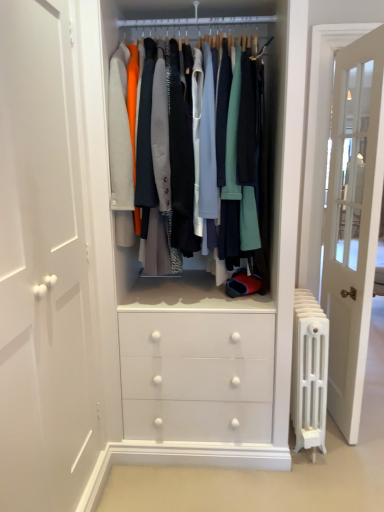
Question: Considering the relative sizes of matte white clothes at center and white metal radiator at right in the image provided, is matte white clothes at center bigger than white metal radiator at right?

Choices:
 (A) yes
 (B) no

Answer: (A)

Question: From the image's perspective, does matte white clothes at center appear higher than white metal radiator at right?

Choices:
 (A) yes
 (B) no

Answer: (A)

Question: From a real-world perspective, is matte white clothes at center under white metal radiator at right?

Choices:
 (A) yes
 (B) no

Answer: (B)

Question: Is matte white clothes at center not inside white metal radiator at right?

Choices:
 (A) no
 (B) yes

Answer: (B)

Question: Is matte white clothes at center smaller than white metal radiator at right?

Choices:
 (A) no
 (B) yes

Answer: (A)

Question: From a real-world perspective, is matte white clothes at center physically located above or below white glass door at right?

Choices:
 (A) above
 (B) below

Answer: (A)

Question: Relative to white glass door at right, is matte white clothes at center in front or behind?

Choices:
 (A) front
 (B) behind

Answer: (A)

Question: Is matte white clothes at center inside or outside of white glass door at right?

Choices:
 (A) outside
 (B) inside

Answer: (A)

Question: Considering the positions of matte white clothes at center and white glass door at right in the image, is matte white clothes at center taller or shorter than white glass door at right?

Choices:
 (A) short
 (B) tall

Answer: (A)

Question: Based on their sizes in the image, would you say white glass door at right is bigger or smaller than matte white clothes at center?

Choices:
 (A) big
 (B) small

Answer: (B)

Question: From a real-world perspective, is white glass door at right physically located above or below matte white clothes at center?

Choices:
 (A) below
 (B) above

Answer: (A)

Question: Relative to matte white clothes at center, is white glass door at right in front or behind?

Choices:
 (A) behind
 (B) front

Answer: (A)

Question: Does point (329, 219) appear closer or farther from the camera than point (230, 141)?

Choices:
 (A) closer
 (B) farther

Answer: (B)

Question: Visually, is matte white clothes at center positioned to the left or to the right of white metal radiator at right?

Choices:
 (A) left
 (B) right

Answer: (A)

Question: From a real-world perspective, is matte white clothes at center physically located above or below white metal radiator at right?

Choices:
 (A) below
 (B) above

Answer: (B)